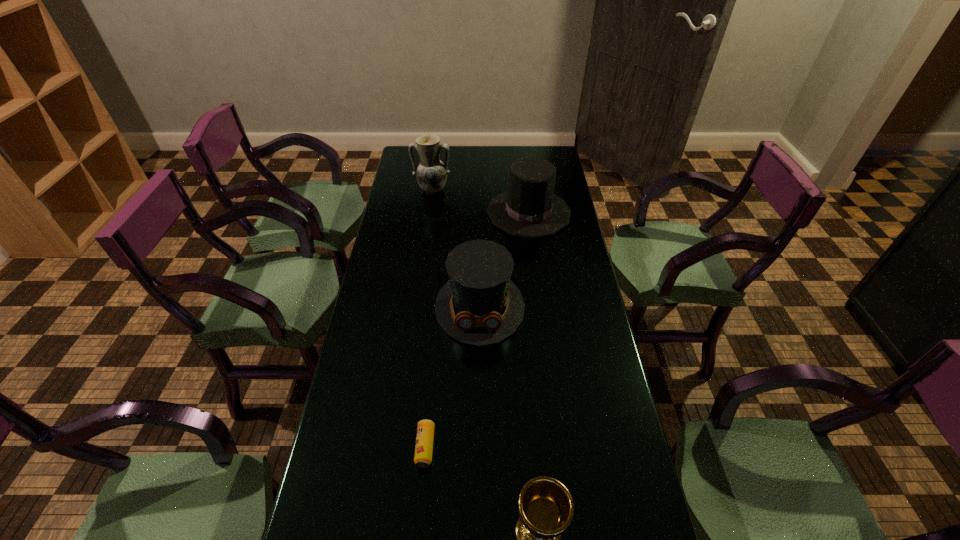
The height and width of the screenshot is (540, 960). Identify the location of pottery. (431, 173).

You are a GUI agent. You are given a task and a screenshot of the screen. Output one action in this format:
    pyautogui.click(x=<x>, y=<y>)
    Task: Click on the farther dress hat
    Image resolution: width=960 pixels, height=540 pixels.
    Given the screenshot: What is the action you would take?
    pyautogui.click(x=529, y=209)

Locate an element on the screen. The image size is (960, 540). the nearer dress hat is located at coordinates (479, 305).

Find the location of a particular element. beer can is located at coordinates (425, 430).

This screenshot has width=960, height=540. Identify the location of the shortest object. (425, 430).

Find the location of `blank area located 0.280m on either side of the pottery`. blank area located 0.280m on either side of the pottery is located at coordinates (425, 241).

Identify the location of free space located on the front of the farther dress hat with the decoration. (534, 254).

Identify the location of free location located 0.230m with goggles on the front of the third farthest object. (480, 419).

Find the location of a particular element. This screenshot has width=960, height=540. free spot located 0.170m on the back of the beer can is located at coordinates (432, 370).

Identify the location of object present at the left edge. (431, 173).